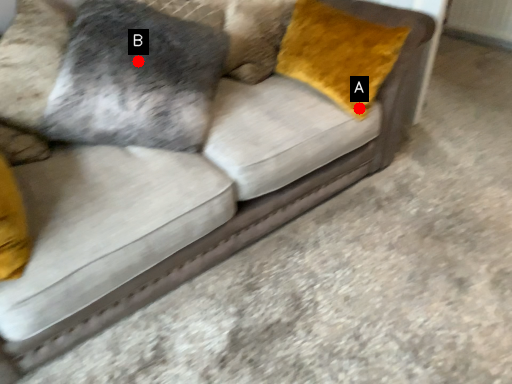
Question: Two points are circled on the image, labeled by A and B beside each circle. Which point is farther to the camera?

Choices:
 (A) A is further
 (B) B is further

Answer: (A)